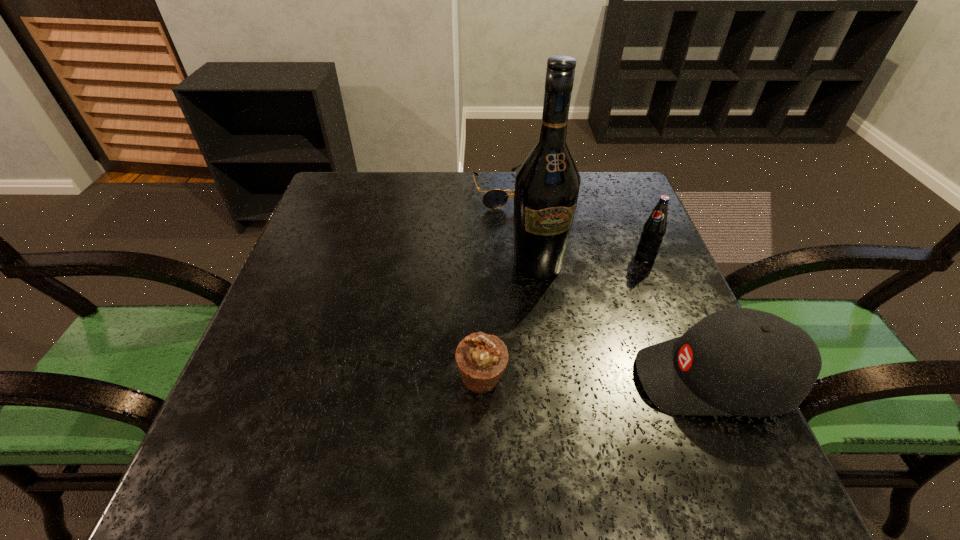
Where is `object that is the third closest one to the wine bottle`? object that is the third closest one to the wine bottle is located at coordinates (735, 362).

Locate which object ranks third in proximity to the baseball cap. Please provide its 2D coordinates. Your answer should be formatted as a tuple, i.e. [(x, y)], where the tuple contains the x and y coordinates of a point satisfying the conditions above.

[(481, 359)]

At what (x,y) coordinates should I click in order to perform the action: click on free region that satisfies the following two spatial constraints: 1. on the front side of the sunglasses; 2. on the right side of the wine bottle. Please return your answer as a coordinate pair (x, y). This screenshot has width=960, height=540. Looking at the image, I should click on (510, 265).

Where is `free spot that satisfies the following two spatial constraints: 1. on the front side of the pop; 2. on the right side of the shortest object`? The height and width of the screenshot is (540, 960). free spot that satisfies the following two spatial constraints: 1. on the front side of the pop; 2. on the right side of the shortest object is located at coordinates (510, 257).